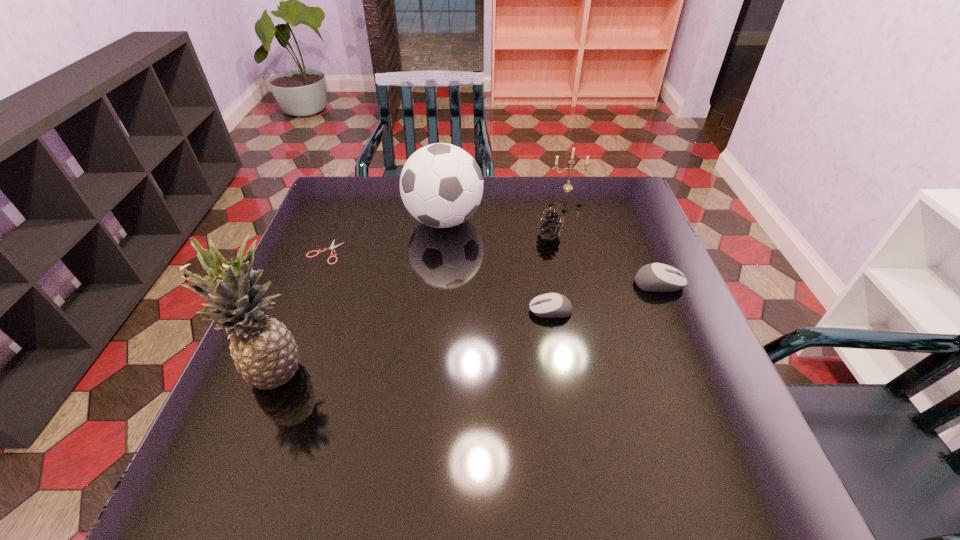
Identify the location of the shorter computer equipment. The image size is (960, 540). (551, 305).

Where is `the sixth farthest object`? The height and width of the screenshot is (540, 960). the sixth farthest object is located at coordinates (551, 305).

Locate an element on the screen. The height and width of the screenshot is (540, 960). the rightmost object is located at coordinates (656, 277).

Locate an element on the screen. the farther computer equipment is located at coordinates (656, 277).

What are the coordinates of `the farthest object` in the screenshot? It's located at (568, 186).

Identify the location of candle. The image size is (960, 540). (568, 186).

Locate an element on the screen. soccer ball is located at coordinates (441, 185).

Where is `the sixth shortest object`? This screenshot has height=540, width=960. the sixth shortest object is located at coordinates (441, 185).

Locate an element on the screen. The image size is (960, 540). shears is located at coordinates (332, 246).

The width and height of the screenshot is (960, 540). In order to click on pinecone in this screenshot , I will do `click(550, 226)`.